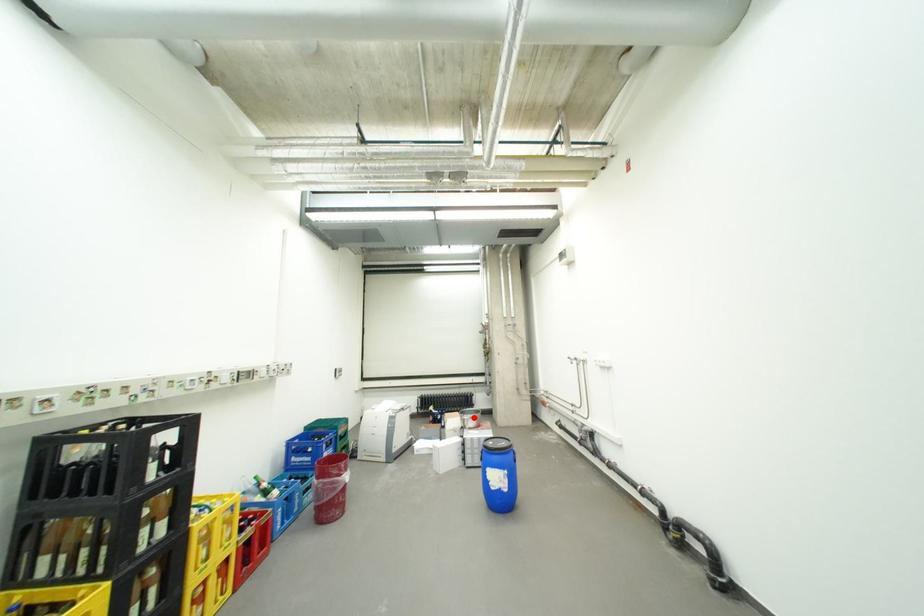
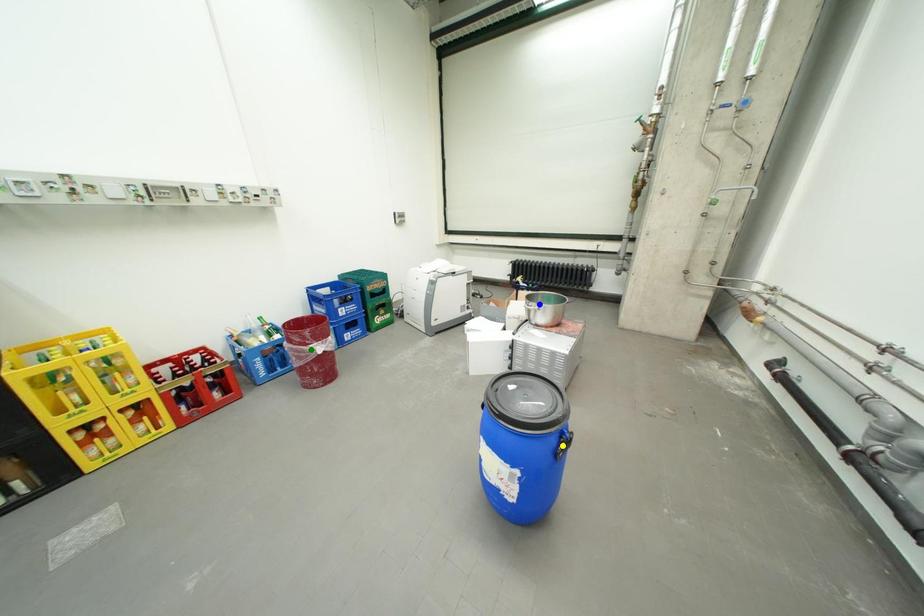
Question: I am providing you with two images of the same scene from different viewpoints. A red point is marked on the first image. You are given multiple points on the second image. Can you choose the point in image 2 that corresponds to the point in image 1?

Choices:
 (A) green point
 (B) blue point
 (C) yellow point

Answer: (B)